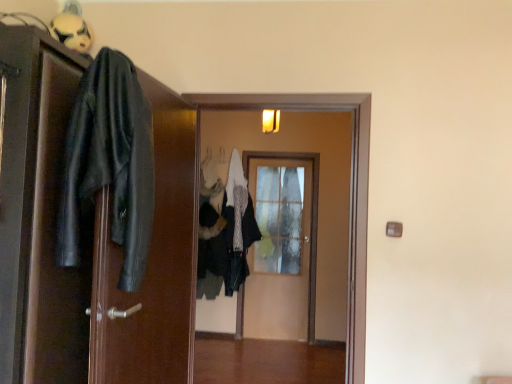
Question: From the image's perspective, is white textured coat at center, which is the 2th clothing in front-to-back order, located above or below black leather jacket at left, the 3th door positioned from the right?

Choices:
 (A) below
 (B) above

Answer: (A)

Question: Is white textured coat at center, the 1th clothing when ordered from back to front, in front of or behind black leather jacket at left, the first door from the front, in the image?

Choices:
 (A) front
 (B) behind

Answer: (B)

Question: Estimate the real-world distances between objects in this image. Which object is closer to the wooden glass door at center, which ranks as the 1th door in right-to-left order?

Choices:
 (A) wooden door at center, which ranks as the 2th door in right-to-left order
 (B) black leather jacket at left
 (C) white textured coat at center, which is the 2th clothing in front-to-back order
 (D) black leather jacket at left, which ranks as the first clothing in left-to-right order
 (E) white matte mask at upper left

Answer: (A)

Question: Considering the real-world distances, which object is farthest from the white textured coat at center, which is the second clothing in left-to-right order?

Choices:
 (A) white matte mask at upper left
 (B) black leather jacket at left, which is the third door from back to front
 (C) black leather jacket at left, which ranks as the first clothing in left-to-right order
 (D) wooden door at center, which ranks as the 2th door in right-to-left order
 (E) wooden glass door at center, which ranks as the first door in back-to-front order

Answer: (C)